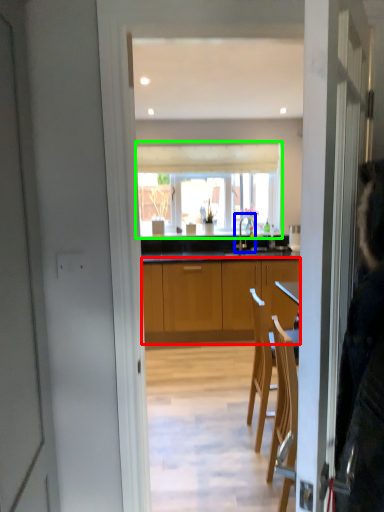
Question: Based on their relative distances, which object is nearer to cabinetry (highlighted by a red box)? Choose from tap (highlighted by a blue box) and window (highlighted by a green box).

Choices:
 (A) tap
 (B) window

Answer: (A)